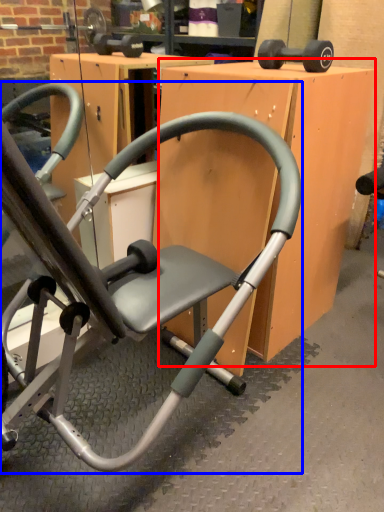
Question: Which object appears closest to the camera in this image, table (highlighted by a red box) or chair (highlighted by a blue box)?

Choices:
 (A) table
 (B) chair

Answer: (B)